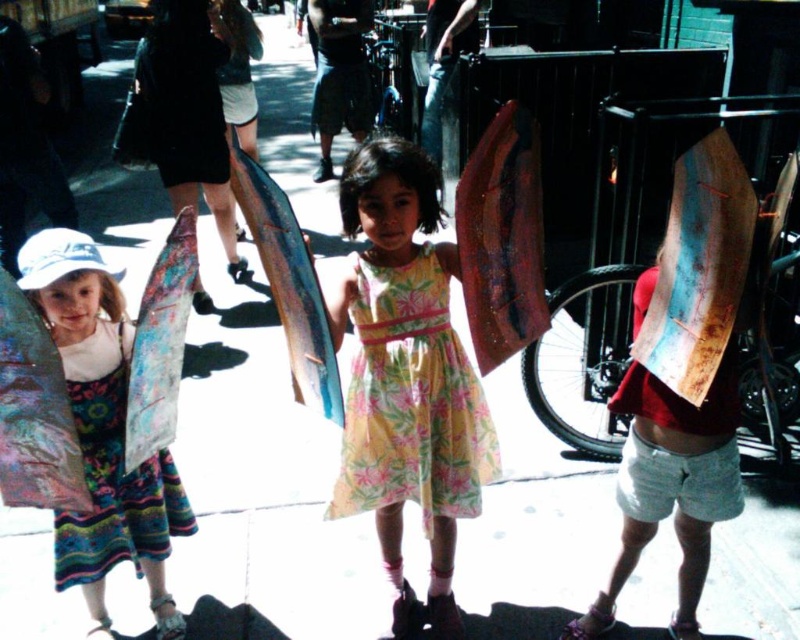
You are a photographer trying to capture both the shiny blue surfboard at center and the floral fabric surfboard at left in a single shot. Given that your camera has a maximum focus range of 30 centimeters, will you be able to include both surfboards in focus?

The shiny blue surfboard at center and floral fabric surfboard at left are 30.09 centimeters apart. Since the distance between them exceeds the camera maximum focus range of 30 centimeters, you won

You are a photographer trying to capture the shiny blue surfboard at center in your shot. The camera you are using has a focal point at coordinates 0.5, 0.5. Will the surfboard be in focus?

The shiny blue surfboard at center is positioned at point (x=288, y=282), which is close to the camera focal point at (x=400, y=320). Therefore, the surfboard will be in focus.

You are a delivery robot with a width of 1.2 meters. You need to move from the wooden surfboard at right to the multicolored floral dress at left. Is there enough space for you to pass through the gap between them?

The distance between the wooden surfboard at right and the multicolored floral dress at left is 1.45 meters. Since the robot is 1.2 meters wide, there is enough space for it to pass through the gap between them.